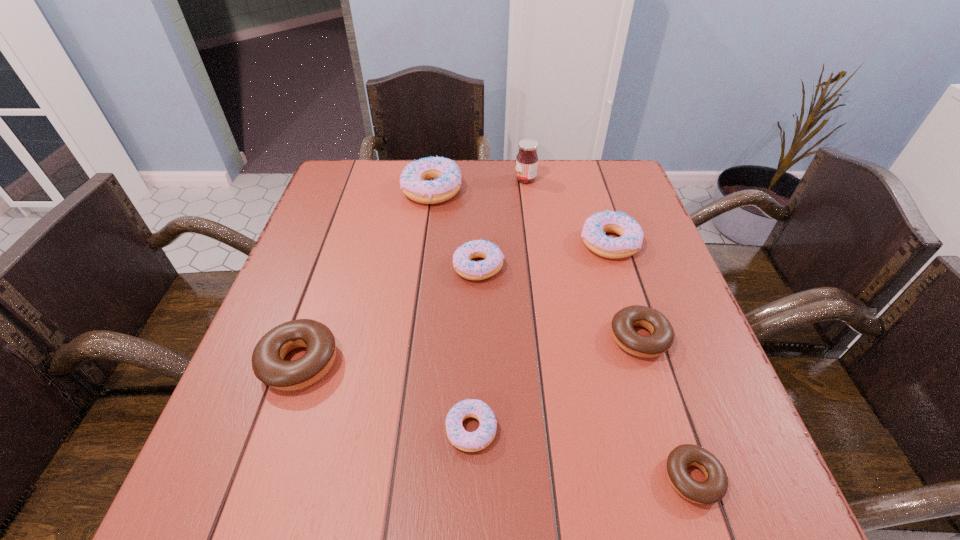
Where is `free space between the farthest purple doughnut and the second biggest purple doughnut`? This screenshot has height=540, width=960. free space between the farthest purple doughnut and the second biggest purple doughnut is located at coordinates (520, 217).

This screenshot has height=540, width=960. What are the coordinates of `empty location between the second smallest purple doughnut and the rightmost purple doughnut` in the screenshot? It's located at (544, 255).

Image resolution: width=960 pixels, height=540 pixels. Identify the location of vacant space that's between the second smallest brown doughnut and the nearest purple doughnut. (556, 383).

I want to click on free space between the farthest purple doughnut and the second smallest brown doughnut, so click(536, 264).

Point out which object is positioned as the seventh nearest to the second biggest purple doughnut. Please provide its 2D coordinates. Your answer should be formatted as a tuple, i.e. [(x, y)], where the tuple contains the x and y coordinates of a point satisfying the conditions above.

[(268, 364)]

Where is `object that is the sixth closest one to the smallest brown doughnut`? object that is the sixth closest one to the smallest brown doughnut is located at coordinates (445, 173).

The width and height of the screenshot is (960, 540). What are the coordinates of `the closest doughnut to the farthest doughnut` in the screenshot? It's located at (471, 270).

This screenshot has height=540, width=960. I want to click on doughnut identified as the sixth closest to the third smallest purple doughnut, so click(x=268, y=364).

The width and height of the screenshot is (960, 540). What are the coordinates of `purple doughnut object that ranks as the third closest to the fourth object from right to left` in the screenshot? It's located at (471, 270).

Where is `purple doughnut that is the second closest one to the second biggest purple doughnut`? The height and width of the screenshot is (540, 960). purple doughnut that is the second closest one to the second biggest purple doughnut is located at coordinates point(445,173).